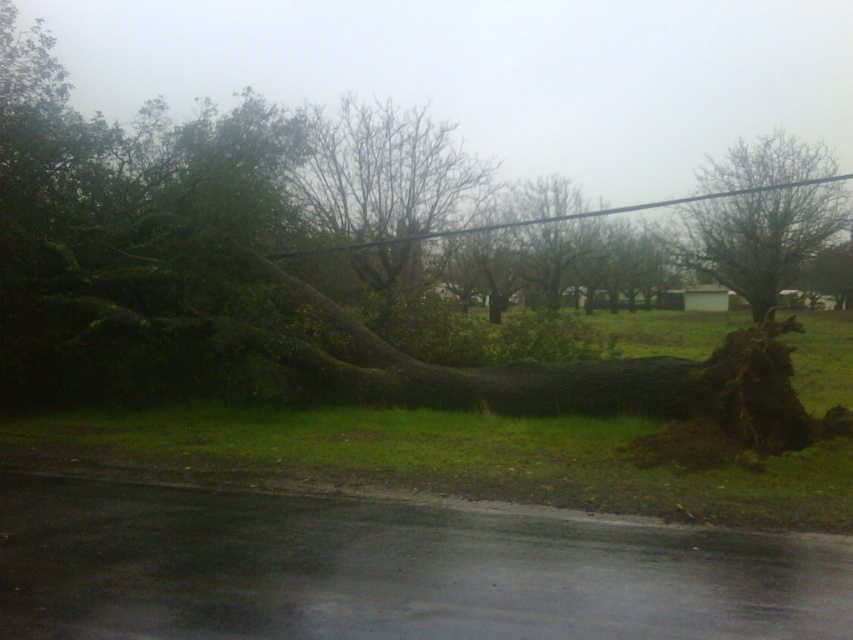
Question: Which of these objects is positioned closest to the black wire at upper center?

Choices:
 (A) bare branches at center
 (B) bare wood tree at center
 (C) dark brown wood at center

Answer: (B)

Question: Is bare wood tree at center above black wire at upper center?

Choices:
 (A) yes
 (B) no

Answer: (A)

Question: Which point appears closest to the camera in this image?

Choices:
 (A) (708, 252)
 (B) (119, 392)
 (C) (775, 186)
 (D) (312, 108)

Answer: (B)

Question: Is bare branches at center thinner than bare wood tree at center?

Choices:
 (A) yes
 (B) no

Answer: (A)

Question: Among these objects, which one is nearest to the camera?

Choices:
 (A) bare wood tree at center
 (B) black wire at upper center

Answer: (B)

Question: Does bare branches at center appear on the left side of bare wood tree at center?

Choices:
 (A) no
 (B) yes

Answer: (B)